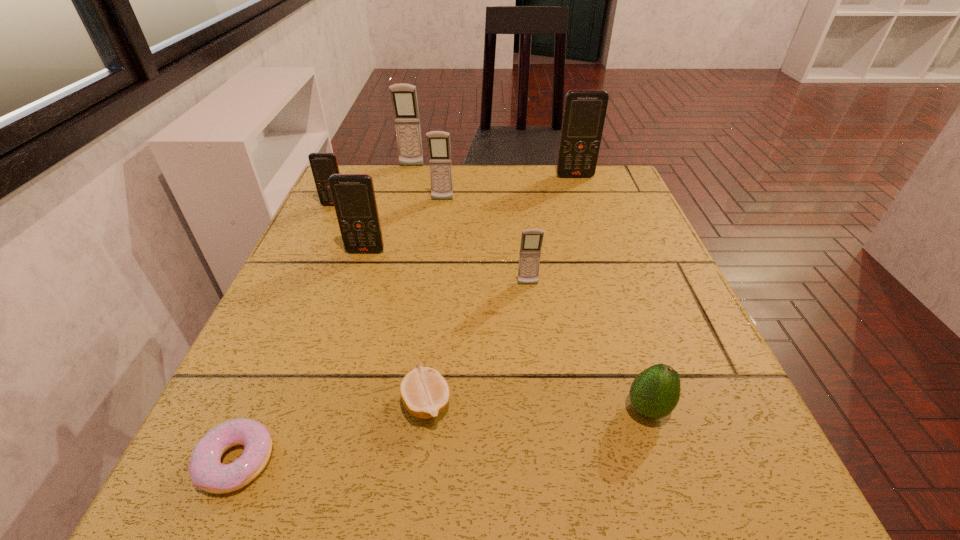
This screenshot has width=960, height=540. Find the location of `free point located 0.290m on the screen of the leftmost orange cellular telephone`. free point located 0.290m on the screen of the leftmost orange cellular telephone is located at coordinates (296, 288).

Where is `vacant space located 0.070m on the front-facing side of the nearest cellular telephone`? The image size is (960, 540). vacant space located 0.070m on the front-facing side of the nearest cellular telephone is located at coordinates (532, 314).

In order to click on vacant area situated on the left of the seventh tallest object in this screenshot , I will do coord(489,409).

Where is `free space located on the back of the lemon`? This screenshot has width=960, height=540. free space located on the back of the lemon is located at coordinates click(434, 334).

At what (x,y) coordinates should I click in order to perform the action: click on free space located on the right of the doughnut. Please return your answer as a coordinate pair (x, y). Looking at the image, I should click on (445, 461).

At what (x,y) coordinates should I click in order to perform the action: click on object at the near edge. Please return your answer as a coordinate pair (x, y). The image size is (960, 540). Looking at the image, I should click on (206, 471).

Locate an element on the screen. doughnut that is at the left edge is located at coordinates pyautogui.click(x=206, y=471).

Find the location of a particular element. cellular telephone at the right edge is located at coordinates (584, 113).

The height and width of the screenshot is (540, 960). Find the location of `avocado present at the right edge`. avocado present at the right edge is located at coordinates (655, 392).

You are a GUI agent. You are given a task and a screenshot of the screen. Output one action in this format:
    pyautogui.click(x=<x>, y=<y>)
    Task: Click on the object located in the far left corner section of the desktop
    The height and width of the screenshot is (540, 960).
    Given the screenshot: What is the action you would take?
    pyautogui.click(x=323, y=165)